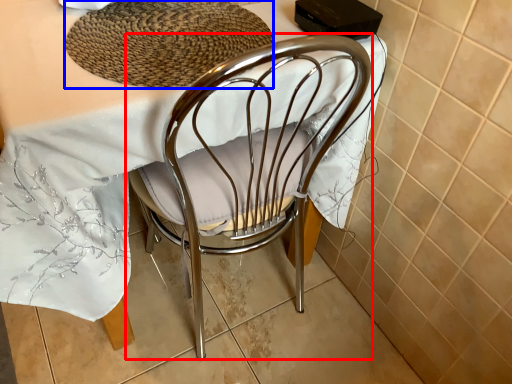
Question: Among these objects, which one is farthest to the camera, chair (highlighted by a red box) or mat (highlighted by a blue box)?

Choices:
 (A) chair
 (B) mat

Answer: (B)